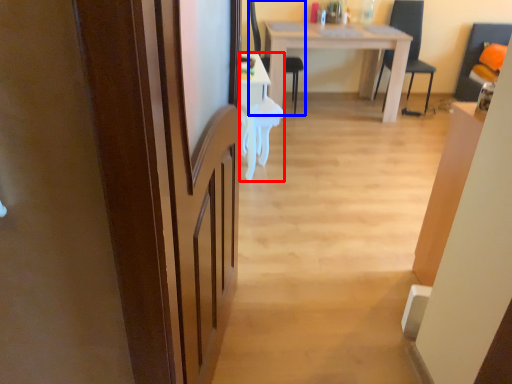
Question: Among these objects, which one is farthest to the camera, desk (highlighted by a red box) or chair (highlighted by a blue box)?

Choices:
 (A) desk
 (B) chair

Answer: (B)